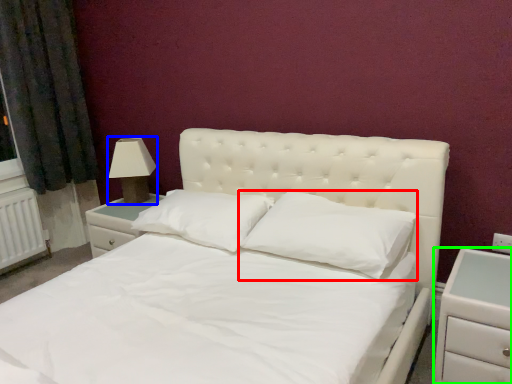
Question: Which object is positioned farthest from pillow (highlighted by a red box)? Select from lamp (highlighted by a blue box) and nightstand (highlighted by a green box).

Choices:
 (A) lamp
 (B) nightstand

Answer: (A)